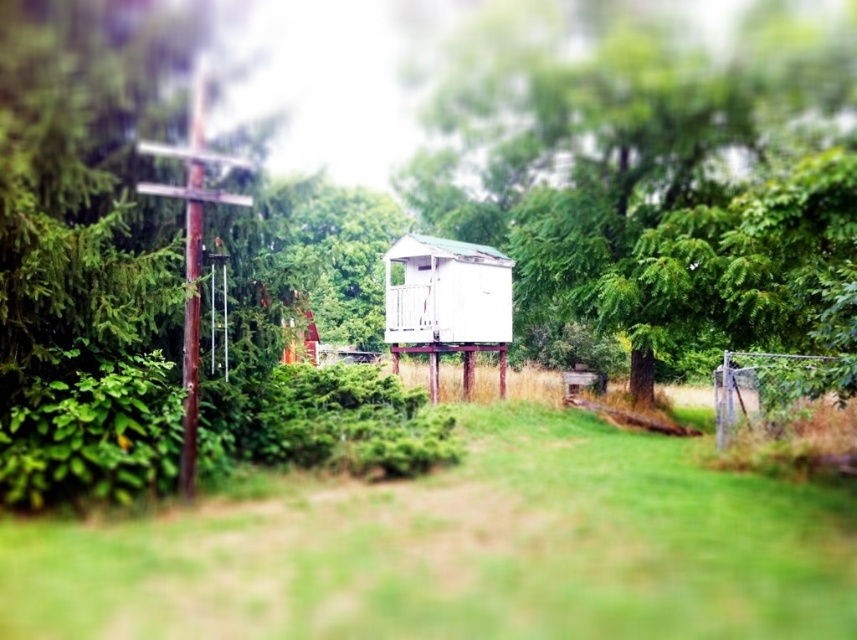
Based on the photo, you are a gardener planning to plant a new flower bed between the green grass at center and the green leafy tree at center. Considering their widths, which area would you choose for the flower bed to ensure it doesn not overcrowd the existing plants?

The green grass at center has a lesser width compared to the green leafy tree at center, so you should choose the area near the green grass at center for the flower bed to avoid overcrowding the wider green leafy tree at center.

What is the 2D coordinate of the green grass at center in the image?

The 2D coordinate of the green grass at center is at point (460, 550).

You are standing in the middle of the grassy area and want to walk to both points. Which point should you reach first, point (x=357, y=588) or point (x=464, y=92)?

You should reach point (x=357, y=588) first because it is closer to you than point (x=464, y=92).